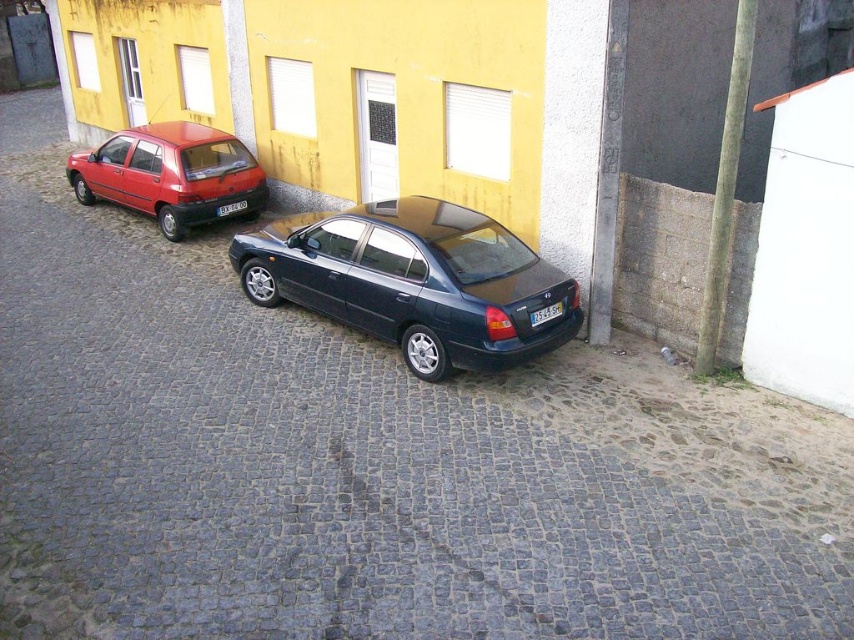
Question: Estimate the real-world distances between objects in this image. Which object is farther from the white plastic license plate at center?

Choices:
 (A) matte red sedan at left
 (B) glossy dark blue sedan at center

Answer: (A)

Question: Among these objects, which one is nearest to the camera?

Choices:
 (A) black plastic license plate at center
 (B) matte red sedan at left
 (C) white plastic license plate at center

Answer: (C)

Question: Can you confirm if white plastic license plate at center is positioned above black plastic license plate at center?

Choices:
 (A) no
 (B) yes

Answer: (A)

Question: Which of these objects is positioned farthest from the matte red sedan at left?

Choices:
 (A) white plastic license plate at center
 (B) black plastic license plate at center

Answer: (A)

Question: Considering the relative positions of matte red sedan at left and black plastic license plate at center in the image provided, where is matte red sedan at left located with respect to black plastic license plate at center?

Choices:
 (A) right
 (B) left

Answer: (B)

Question: Considering the relative positions of white plastic license plate at center and black plastic license plate at center in the image provided, where is white plastic license plate at center located with respect to black plastic license plate at center?

Choices:
 (A) left
 (B) right

Answer: (B)